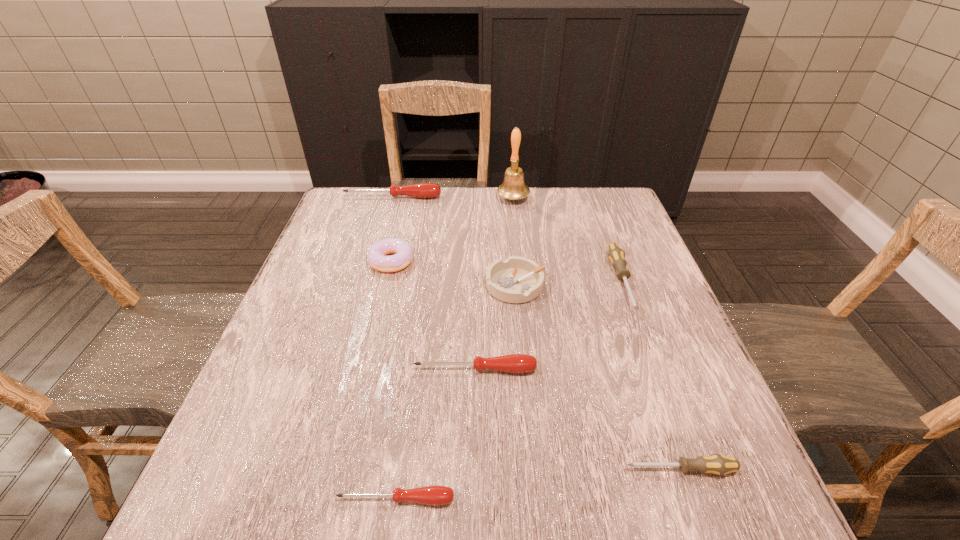
The width and height of the screenshot is (960, 540). I want to click on blank space at the near edge, so click(386, 498).

The image size is (960, 540). In the image, there is a desktop. Identify the location of vacant space at the left edge. (286, 400).

In the image, there is a desktop. At what (x,y) coordinates should I click in order to perform the action: click on free space at the right edge. Please return your answer as a coordinate pair (x, y). The image size is (960, 540). Looking at the image, I should click on (667, 329).

Find the location of `free location at the far left corner`. free location at the far left corner is located at coordinates (370, 197).

At what (x,y) coordinates should I click in order to perform the action: click on vacant space at the near left corner. Please return your answer as a coordinate pair (x, y). Looking at the image, I should click on (193, 504).

In the image, there is a desktop. At what (x,y) coordinates should I click in order to perform the action: click on vacant space at the far right corner. Please return your answer as a coordinate pair (x, y). This screenshot has height=540, width=960. Looking at the image, I should click on (578, 217).

The height and width of the screenshot is (540, 960). Identify the location of empty space that is in between the bell and the ashtray. (515, 242).

I want to click on vacant space in between the second nearest red screwdriver and the ashtray, so click(495, 327).

Find the location of a particular element. The image size is (960, 540). free space between the smallest red screwdriver and the second farthest screwdriver is located at coordinates (509, 390).

At what (x,y) coordinates should I click in order to perform the action: click on free space between the farthest red screwdriver and the doughnut. Please return your answer as a coordinate pair (x, y). Looking at the image, I should click on (392, 229).